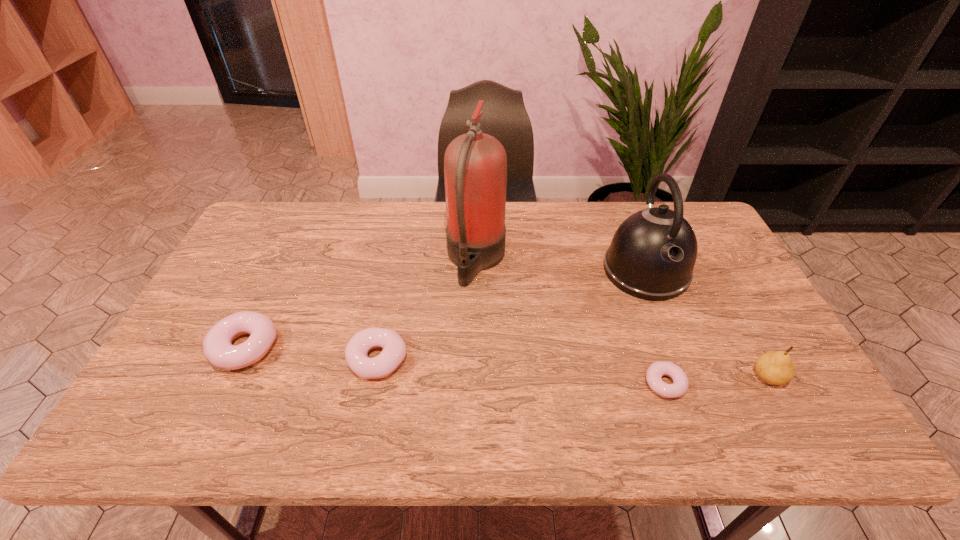
This screenshot has height=540, width=960. In order to click on kettle at the right edge in this screenshot , I will do `click(652, 255)`.

This screenshot has width=960, height=540. I want to click on pear present at the right edge, so click(775, 367).

Where is `object present at the near left corner`? The height and width of the screenshot is (540, 960). object present at the near left corner is located at coordinates pyautogui.click(x=218, y=349).

Locate an element on the screen. The height and width of the screenshot is (540, 960). object at the far right corner is located at coordinates (652, 255).

The width and height of the screenshot is (960, 540). In order to click on object situated at the near right corner in this screenshot , I will do `click(775, 367)`.

In the image, there is a desktop. Identify the location of vacant space at the far edge. This screenshot has height=540, width=960. (574, 226).

You are a GUI agent. You are given a task and a screenshot of the screen. Output one action in this format:
    pyautogui.click(x=<x>, y=<y>)
    Task: Click on the free space at the near edge of the desktop
    The height and width of the screenshot is (540, 960).
    Given the screenshot: What is the action you would take?
    pyautogui.click(x=270, y=398)

Where is `vacant space at the left edge of the desktop`? vacant space at the left edge of the desktop is located at coordinates tap(180, 363).

Locate an element on the screen. The image size is (960, 540). vacant area at the right edge is located at coordinates (703, 296).

At what (x,y) coordinates should I click in order to perform the action: click on vacant space at the far left corner. Please return your answer as a coordinate pair (x, y). Looking at the image, I should click on (281, 207).